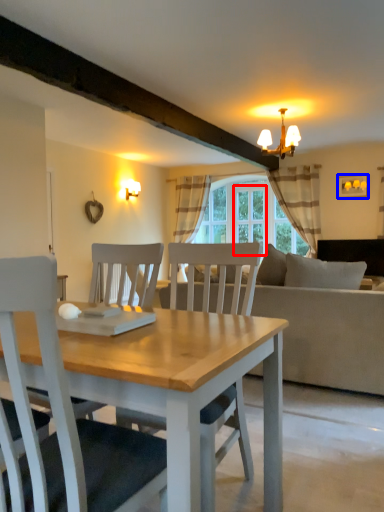
Question: Which of the following is the closest to the observer, glass door (highlighted by a red box) or picture frame (highlighted by a blue box)?

Choices:
 (A) glass door
 (B) picture frame

Answer: (B)